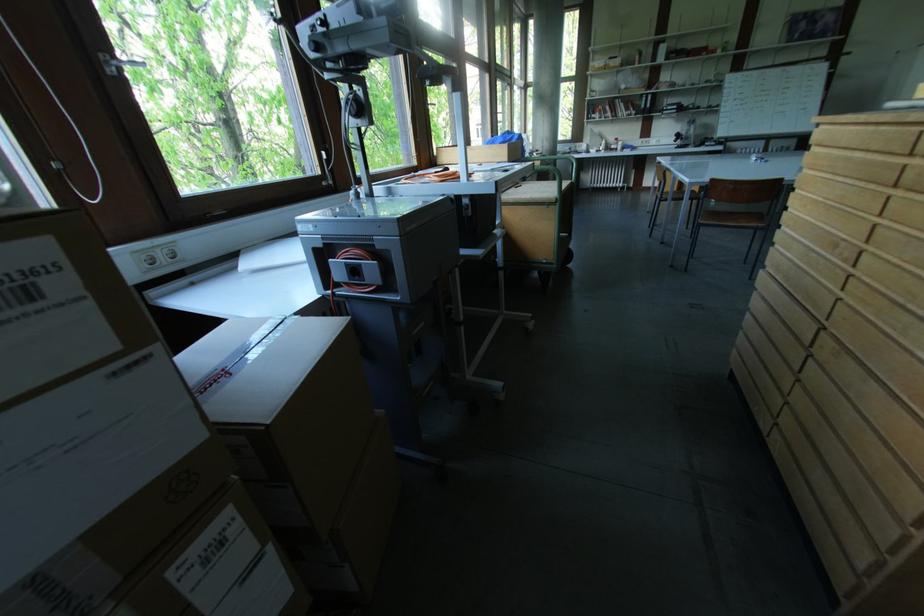
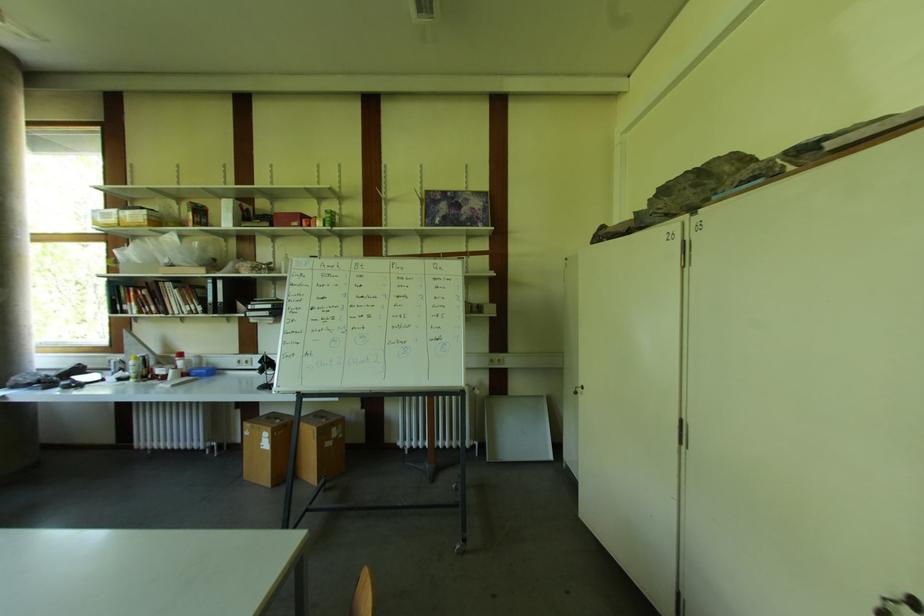
In the second image, find the point that corresponds to point (639, 63) in the first image.

(193, 225)